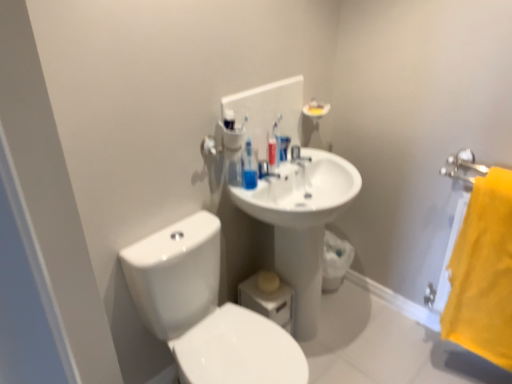
Locate an element on the screen. The image size is (512, 384). blue plastic mouthwash at center is located at coordinates (283, 147).

At what (x,y) coordinates should I click in order to perform the action: click on yellow fabric towel at right. Please return your answer as a coordinate pair (x, y). Image resolution: width=512 pixels, height=384 pixels. Looking at the image, I should click on (483, 273).

This screenshot has height=384, width=512. Describe the element at coordinates (205, 310) in the screenshot. I see `white glossy toilet at lower left` at that location.

Locate an element on the screen. white glossy sink at center is located at coordinates (298, 156).

Do you think blue plastic mouthwash at center is within translucent plastic toothbrushes at upper center, or outside of it?

blue plastic mouthwash at center cannot be found inside translucent plastic toothbrushes at upper center.

Is blue plastic mouthwash at center not close to translucent plastic toothbrushes at upper center?

Actually, blue plastic mouthwash at center and translucent plastic toothbrushes at upper center are a little close together.

From the image's perspective, is blue plastic mouthwash at center located above translucent plastic toothbrushes at upper center?

Yes, from the image's perspective, blue plastic mouthwash at center is above translucent plastic toothbrushes at upper center.

From the image's perspective, relative to translucent plastic toothbrushes at upper center, is yellow fabric towel at right above or below?

Based on their image positions, yellow fabric towel at right is located beneath translucent plastic toothbrushes at upper center.

Does yellow fabric towel at right appear on the right side of translucent plastic toothbrushes at upper center?

Yes, yellow fabric towel at right is to the right of translucent plastic toothbrushes at upper center.

In the scene shown: In terms of width, does yellow fabric towel at right look wider or thinner when compared to translucent plastic toothbrushes at upper center?

yellow fabric towel at right is wider than translucent plastic toothbrushes at upper center.

Do you think yellow fabric towel at right is within translucent plastic toothbrushes at upper center, or outside of it?

yellow fabric towel at right is not enclosed by translucent plastic toothbrushes at upper center.

From the image's perspective, which is above, white glossy sink at center or yellow fabric towel at right?

white glossy sink at center.

Considering the sizes of objects white glossy sink at center and yellow fabric towel at right in the image provided, who is shorter, white glossy sink at center or yellow fabric towel at right?

white glossy sink at center.

Does white glossy sink at center lie behind yellow fabric towel at right?

Yes, white glossy sink at center is further from the camera.

Could you tell me if white glossy sink at center is facing yellow fabric towel at right?

No, white glossy sink at center is not facing towards yellow fabric towel at right.

How distant is white glossy sink at center from blue plastic mouthwash at center?

white glossy sink at center is 7.75 centimeters away from blue plastic mouthwash at center.

Which of these two, white glossy sink at center or blue plastic mouthwash at center, is wider?

With larger width is white glossy sink at center.

Can you tell me how much white glossy sink at center and blue plastic mouthwash at center differ in facing direction?

The facing directions of white glossy sink at center and blue plastic mouthwash at center are 1.65 degrees apart.

From a real-world perspective, which is physically above, white glossy sink at center or blue plastic mouthwash at center?

blue plastic mouthwash at center.

Is translucent plastic toothbrushes at upper center oriented away from white glossy sink at center?

translucent plastic toothbrushes at upper center does not have its back to white glossy sink at center.

Which is correct: translucent plastic toothbrushes at upper center is inside white glossy sink at center, or outside of it?

translucent plastic toothbrushes at upper center is located beyond the bounds of white glossy sink at center.

Between translucent plastic toothbrushes at upper center and white glossy sink at center, which one has smaller size?

Smaller between the two is white glossy sink at center.

Considering the positions of objects translucent plastic toothbrushes at upper center and white glossy sink at center in the image provided, who is more to the right, translucent plastic toothbrushes at upper center or white glossy sink at center?

Positioned to the right is white glossy sink at center.

Which is in front, point (295, 162) or point (306, 224)?

The point (306, 224) is closer.

Is the surface of white glossy sink at center in direct contact with white glossy sink at center?

No, white glossy sink at center is not making contact with white glossy sink at center.

From a real-world perspective, which is physically above, white glossy sink at center or white glossy sink at center?

white glossy sink at center is physically above.

Is white glossy sink at center bigger or smaller than white glossy sink at center?

Considering their sizes, white glossy sink at center takes up less space than white glossy sink at center.

Where is `toilet in front of the white glossy sink at center`? toilet in front of the white glossy sink at center is located at coordinates (205, 310).

Which is more to the right, white glossy toilet at lower left or white glossy sink at center?

white glossy sink at center is more to the right.

Is white glossy toilet at lower left facing away from white glossy sink at center?

No.

Where is `toiletry above the blue plastic mouthwash at center (from a real-world perspective)`? toiletry above the blue plastic mouthwash at center (from a real-world perspective) is located at coordinates (249, 167).

This screenshot has height=384, width=512. In order to click on beach towel on the right of translucent plastic toothbrushes at upper center in this screenshot , I will do `click(483, 273)`.

Considering their positions, is white glossy sink at center positioned closer to white glossy toilet at lower left than white glossy sink at center?

The object closer to white glossy toilet at lower left is white glossy sink at center.

Which object lies nearer to the anchor point white glossy toilet at lower left, translucent plastic toothbrushes at upper center or white glossy sink at center?

translucent plastic toothbrushes at upper center lies closer to white glossy toilet at lower left than the other object.

Considering their positions, is white glossy sink at center positioned further to blue plastic mouthwash at center than yellow fabric towel at right?

yellow fabric towel at right.

Which object lies nearer to the anchor point white glossy sink at center, white glossy toilet at lower left or white glossy sink at center?

white glossy sink at center lies closer to white glossy sink at center than the other object.

Which object lies nearer to the anchor point blue plastic mouthwash at center, yellow fabric towel at right or translucent plastic toothbrushes at upper center?

translucent plastic toothbrushes at upper center is positioned closer to the anchor blue plastic mouthwash at center.

Based on their spatial positions, is translucent plastic toothbrushes at upper center or white glossy toilet at lower left further from white glossy sink at center?

white glossy toilet at lower left.

Based on their spatial positions, is white glossy toilet at lower left or yellow fabric towel at right closer to blue plastic mouthwash at center?

white glossy toilet at lower left is closer to blue plastic mouthwash at center.

Estimate the real-world distances between objects in this image. Which object is further from white glossy toilet at lower left, white glossy sink at center or yellow fabric towel at right?

yellow fabric towel at right is further to white glossy toilet at lower left.

What are the coordinates of `sink between white glossy toilet at lower left and white glossy sink at center in the front-back direction` in the screenshot? It's located at (302, 224).

The height and width of the screenshot is (384, 512). I want to click on sink between white glossy sink at center and yellow fabric towel at right from left to right, so click(302, 224).

Locate an element on the screen. The height and width of the screenshot is (384, 512). mouthwash between translucent plastic toothbrushes at upper center and white glossy sink at center along the z-axis is located at coordinates (283, 147).

Where is `sink located between blue plastic mouthwash at center and yellow fabric towel at right in the left-right direction`? Image resolution: width=512 pixels, height=384 pixels. sink located between blue plastic mouthwash at center and yellow fabric towel at right in the left-right direction is located at coordinates (302, 224).